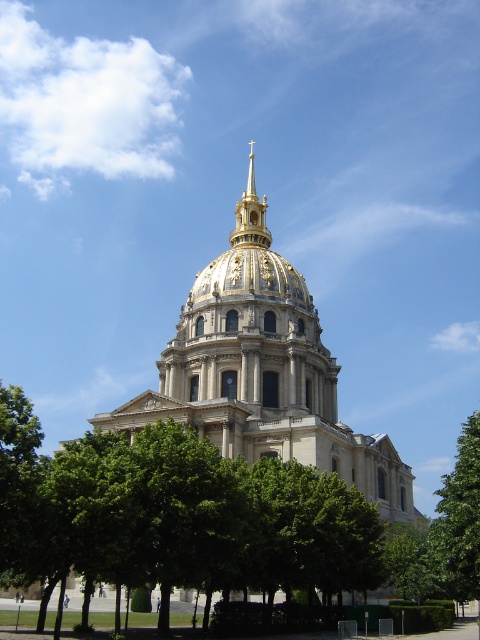
Question: Is green leafy tree at right positioned behind gold/gilded metal spire at upper center?

Choices:
 (A) no
 (B) yes

Answer: (A)

Question: Can you confirm if beige stone dome at center is positioned below gold/gilded metal spire at upper center?

Choices:
 (A) yes
 (B) no

Answer: (A)

Question: Based on their relative distances, which object is farther from the gold/gilded metal spire at upper center?

Choices:
 (A) green leafy tree at center
 (B) green leafy tree at right
 (C) beige stone dome at center

Answer: (A)

Question: Considering the relative positions of green leafy tree at center and beige stone dome at center in the image provided, where is green leafy tree at center located with respect to beige stone dome at center?

Choices:
 (A) below
 (B) above

Answer: (A)

Question: Considering the real-world distances, which object is closest to the gold/gilded metal spire at upper center?

Choices:
 (A) green leafy tree at right
 (B) green leafy tree at center
 (C) beige stone dome at center

Answer: (C)

Question: Among these objects, which one is farthest from the camera?

Choices:
 (A) beige stone dome at center
 (B) green leafy tree at center
 (C) gold/gilded metal spire at upper center

Answer: (C)